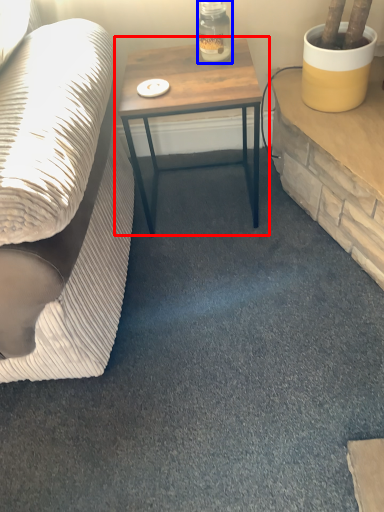
Question: Among these objects, which one is farthest to the camera, table (highlighted by a red box) or bottle (highlighted by a blue box)?

Choices:
 (A) table
 (B) bottle

Answer: (B)